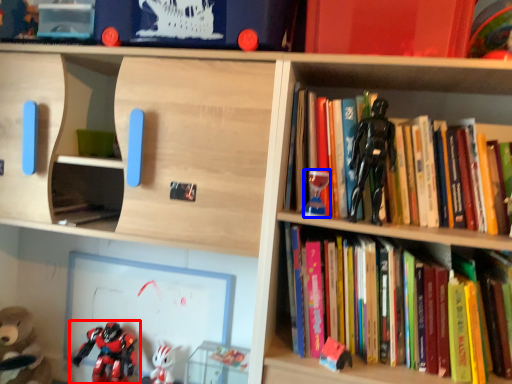
Question: Which object is closer to the camera taking this photo, toy (highlighted by a red box) or toy (highlighted by a blue box)?

Choices:
 (A) toy
 (B) toy

Answer: (B)